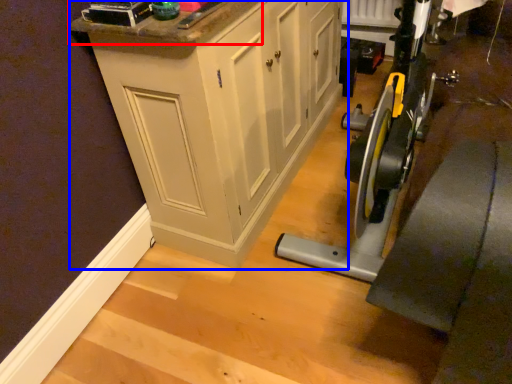
Question: Which object is further to the camera taking this photo, counter top (highlighted by a red box) or cabinetry (highlighted by a blue box)?

Choices:
 (A) counter top
 (B) cabinetry

Answer: (B)